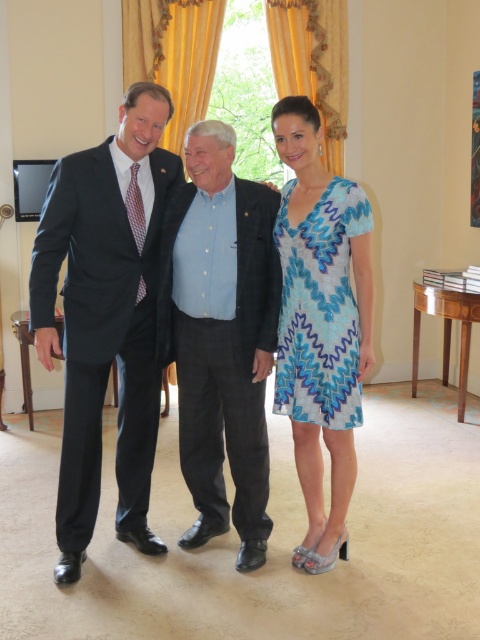
Does matte black suit at left have a lesser height compared to blue printed fabric dress at right?

No, matte black suit at left is not shorter than blue printed fabric dress at right.

Which is behind, point (182, 426) or point (312, 301)?

The point (182, 426) is behind.

Identify the location of matte black suit at left. Image resolution: width=480 pixels, height=640 pixels. (224, 346).

Does point (229, 310) come closer to viewer compared to point (317, 195)?

No, (229, 310) is behind (317, 195).

Is point (271, 364) in front of point (283, 243)?

No, (271, 364) is further to viewer.

What are the coordinates of `blue cotton shirt at center` in the screenshot? It's located at (220, 337).

Does dark blue suit at left appear over matte black suit at left?

No, dark blue suit at left is not above matte black suit at left.

Is dark blue suit at left positioned in front of matte black suit at left?

That is False.

Is point (71, 525) less distant than point (242, 241)?

That is False.

Identify the location of dark blue suit at left. The height and width of the screenshot is (640, 480). (106, 316).